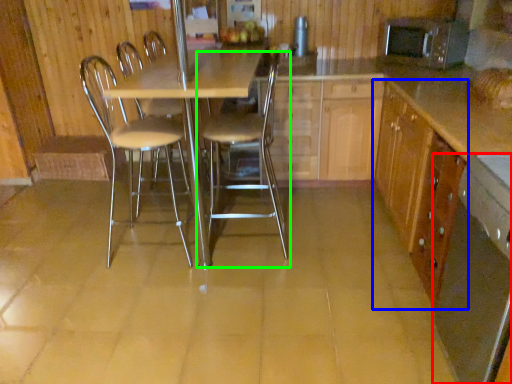
Question: Considering the real-world distances, which object is closest to kitchen appliance (highlighted by a red box)? cabinetry (highlighted by a blue box) or chair (highlighted by a green box).

Choices:
 (A) cabinetry
 (B) chair

Answer: (A)